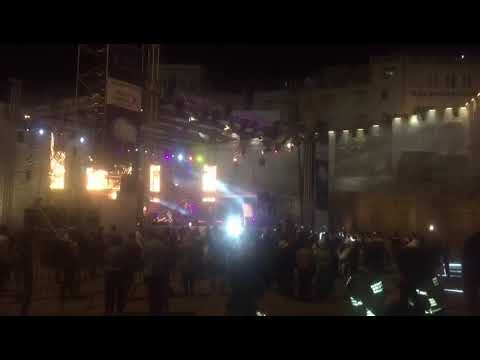
Where is `colorful lights`? colorful lights is located at coordinates (176, 155).